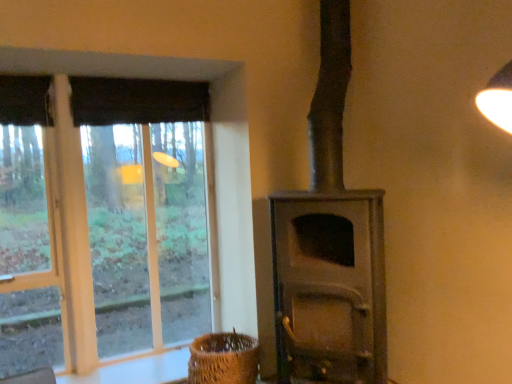
Question: Is the position of matte gray wood burning stove at center less distant than that of dark fabric curtain at upper left?

Choices:
 (A) yes
 (B) no

Answer: (A)

Question: From the image's perspective, is matte gray wood burning stove at center over dark fabric curtain at upper left?

Choices:
 (A) yes
 (B) no

Answer: (B)

Question: Is matte gray wood burning stove at center thinner than dark fabric curtain at upper left?

Choices:
 (A) yes
 (B) no

Answer: (B)

Question: From the image's perspective, is matte gray wood burning stove at center located beneath dark fabric curtain at upper left?

Choices:
 (A) yes
 (B) no

Answer: (A)

Question: Is matte gray wood burning stove at center positioned with its back to dark fabric curtain at upper left?

Choices:
 (A) no
 (B) yes

Answer: (A)

Question: Is matte gray wood burning stove at center taller than dark fabric curtain at upper left?

Choices:
 (A) no
 (B) yes

Answer: (B)

Question: Is brown woven basket at lower center oriented towards matte gray wood burning stove at center?

Choices:
 (A) yes
 (B) no

Answer: (B)

Question: Is brown woven basket at lower center taller than matte gray wood burning stove at center?

Choices:
 (A) yes
 (B) no

Answer: (B)

Question: Considering the relative sizes of brown woven basket at lower center and matte gray wood burning stove at center in the image provided, is brown woven basket at lower center bigger than matte gray wood burning stove at center?

Choices:
 (A) no
 (B) yes

Answer: (A)

Question: Is brown woven basket at lower center thinner than matte gray wood burning stove at center?

Choices:
 (A) no
 (B) yes

Answer: (B)

Question: Can you confirm if brown woven basket at lower center is wider than matte gray wood burning stove at center?

Choices:
 (A) no
 (B) yes

Answer: (A)

Question: Could matte gray wood burning stove at center be considered to be inside brown woven basket at lower center?

Choices:
 (A) no
 (B) yes

Answer: (A)

Question: Can you confirm if brown woven basket at lower center is bigger than clear glass window at left?

Choices:
 (A) no
 (B) yes

Answer: (A)